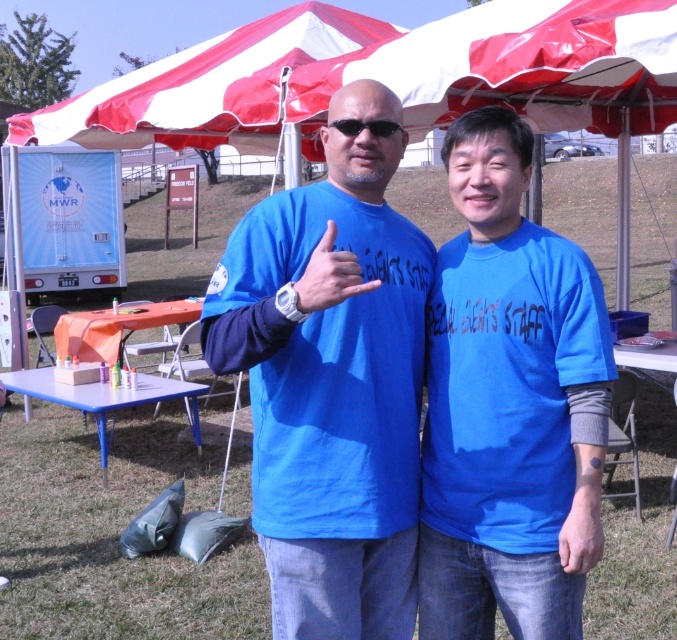
Between point (253, 116) and point (303, 278), which one is positioned in front?

Point (303, 278)

Between red/white fabric canopy at upper center and blue fabric hand at center, which one has less height?

blue fabric hand at center is shorter.

Is point (49, 124) less distant than point (311, 308)?

No, it is not.

Locate an element on the screen. The height and width of the screenshot is (640, 677). red/white fabric canopy at upper center is located at coordinates (204, 84).

Who is more forward, (385,227) or (590,404)?

Point (590,404) is more forward.

Is matte blue shirt at center to the right of blue matte shirt at center from the viewer's perspective?

Incorrect, matte blue shirt at center is not on the right side of blue matte shirt at center.

The image size is (677, 640). Describe the element at coordinates (330, 388) in the screenshot. I see `matte blue shirt at center` at that location.

I want to click on matte blue shirt at center, so click(330, 388).

Is matte blue shirt at center closer to the viewer compared to black plastic sunglasses at center?

Yes.

Is matte blue shirt at center shorter than black plastic sunglasses at center?

No.

Does point (288, 509) lie behind point (328, 124)?

No, it is not.

Locate an element on the screen. matte blue shirt at center is located at coordinates (330, 388).